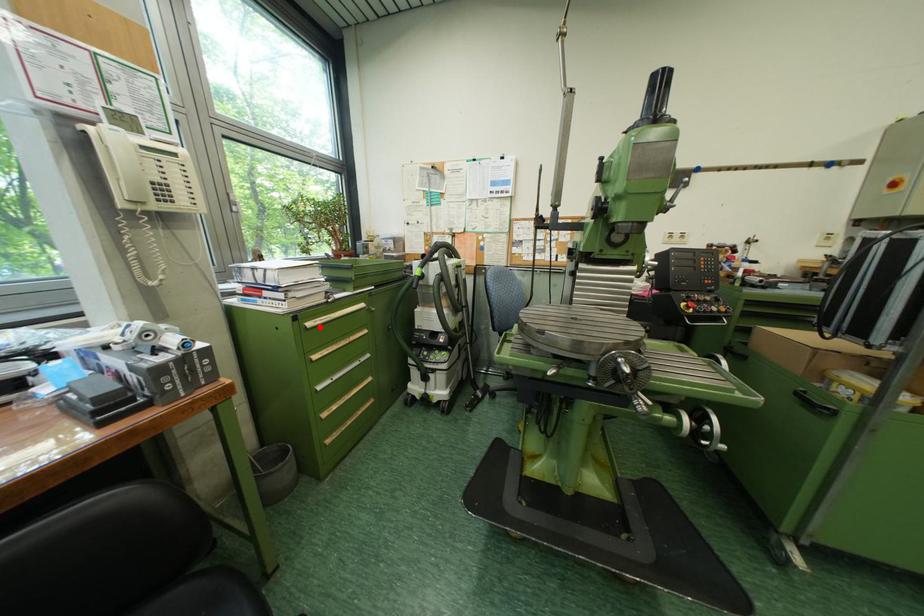
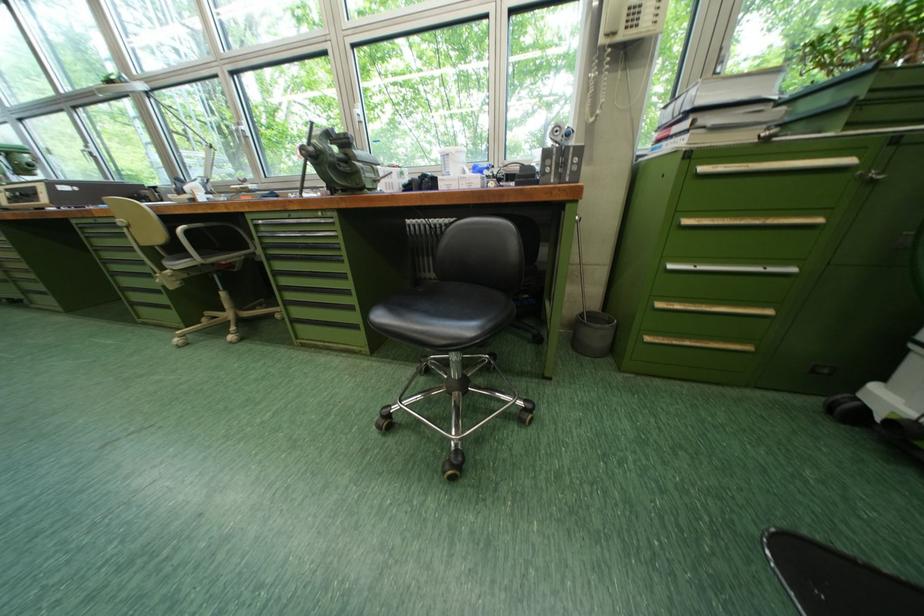
Question: I am providing you with two images of the same scene from different viewpoints. A red point is shown in image1. For the corresponding object point in image2, is it positioned nearer or farther from the camera?

Choices:
 (A) Nearer
 (B) Farther

Answer: (B)